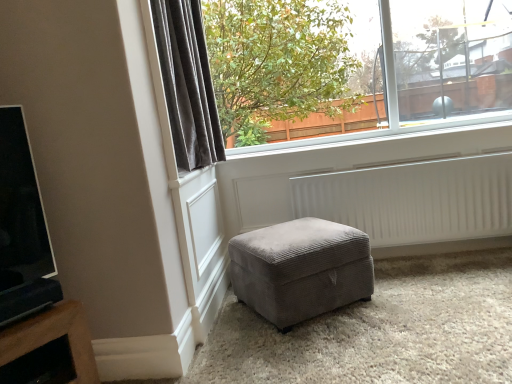
Locate an element on the screen. free location to the right of velvet grey ottoman at center is located at coordinates (415, 300).